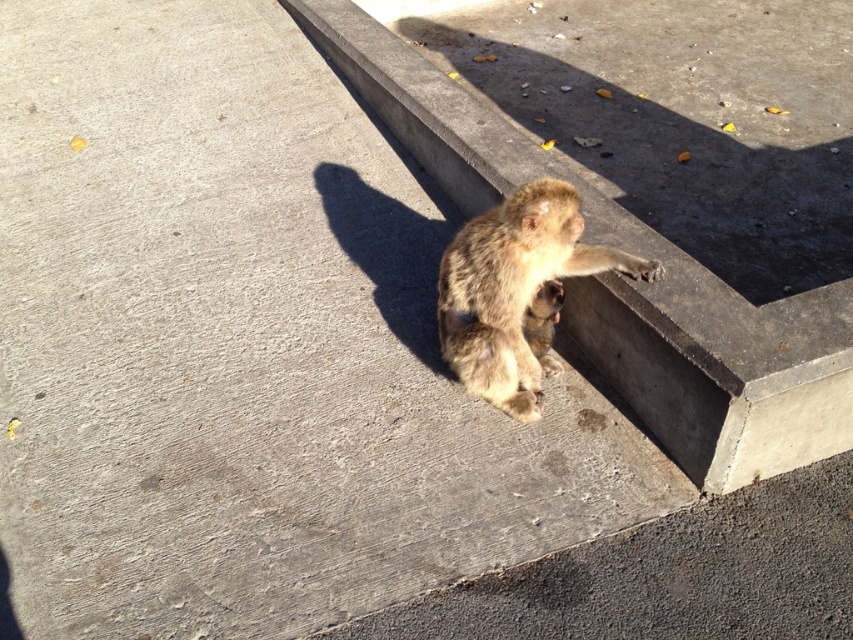
Who is positioned more to the left, concrete ledge at center or fuzzy fur monkey at upper right?

From the viewer's perspective, concrete ledge at center appears more on the left side.

Can you confirm if concrete ledge at center is smaller than fuzzy fur monkey at upper right?

Incorrect, concrete ledge at center is not smaller in size than fuzzy fur monkey at upper right.

Does point (699, 404) lie behind point (476, 381)?

No, (699, 404) is closer to viewer.

The height and width of the screenshot is (640, 853). Find the location of `concrete ledge at center`. concrete ledge at center is located at coordinates (627, 282).